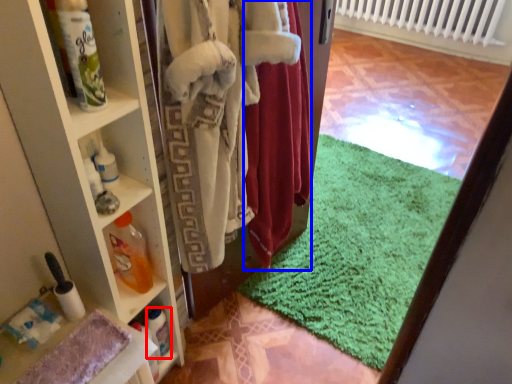
Question: Which of the following is the closest to the observer, bottle (highlighted by a red box) or clothing (highlighted by a blue box)?

Choices:
 (A) bottle
 (B) clothing

Answer: (B)